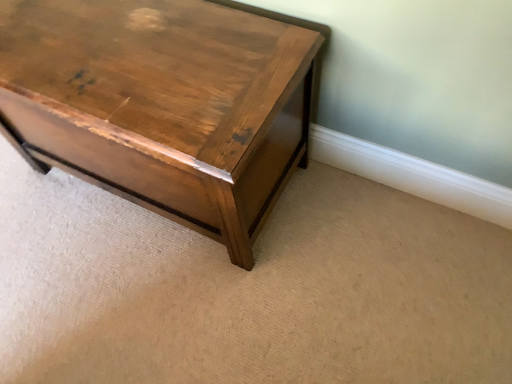
Where is `empty space that is ontop of shiny brown wood table at center (from a real-world perspective)`? empty space that is ontop of shiny brown wood table at center (from a real-world perspective) is located at coordinates (131, 49).